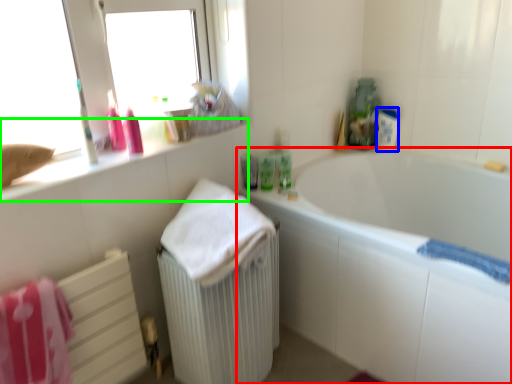
Question: Estimate the real-world distances between objects in this image. Which object is closer to bathtub (highlighted by a red box), toiletry (highlighted by a blue box) or counter top (highlighted by a green box)?

Choices:
 (A) toiletry
 (B) counter top

Answer: (A)